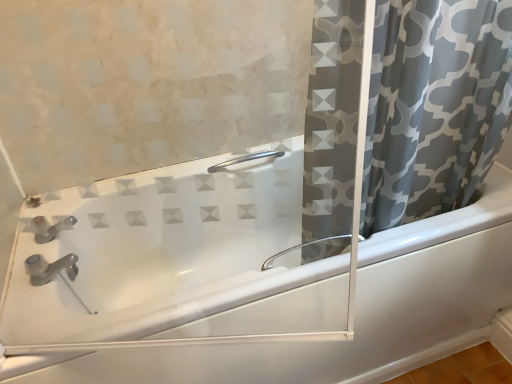
Question: Is gray printed fabric curtain at right at the right side of satin nickel faucet at upper left?

Choices:
 (A) yes
 (B) no

Answer: (A)

Question: Is gray printed fabric curtain at right completely or partially outside of satin nickel faucet at upper left?

Choices:
 (A) no
 (B) yes

Answer: (B)

Question: Does gray printed fabric curtain at right turn towards satin nickel faucet at upper left?

Choices:
 (A) no
 (B) yes

Answer: (A)

Question: Can you confirm if gray printed fabric curtain at right is smaller than satin nickel faucet at upper left?

Choices:
 (A) no
 (B) yes

Answer: (A)

Question: Is satin nickel faucet at upper left located within gray printed fabric curtain at right?

Choices:
 (A) no
 (B) yes

Answer: (A)

Question: From a real-world perspective, is satin nickel grab bar at upper center positioned above or below satin nickel faucet at upper left?

Choices:
 (A) above
 (B) below

Answer: (B)

Question: Is satin nickel grab bar at upper center situated inside satin nickel faucet at upper left or outside?

Choices:
 (A) outside
 (B) inside

Answer: (A)

Question: Considering the positions of satin nickel grab bar at upper center and satin nickel faucet at upper left in the image, is satin nickel grab bar at upper center wider or thinner than satin nickel faucet at upper left?

Choices:
 (A) thin
 (B) wide

Answer: (A)

Question: Is satin nickel grab bar at upper center to the left or to the right of satin nickel faucet at upper left in the image?

Choices:
 (A) right
 (B) left

Answer: (A)

Question: Based on their sizes in the image, would you say gray printed fabric curtain at right is bigger or smaller than white glossy bathtub at center?

Choices:
 (A) big
 (B) small

Answer: (B)

Question: In the image, is gray printed fabric curtain at right on the left side or the right side of white glossy bathtub at center?

Choices:
 (A) right
 (B) left

Answer: (A)

Question: From the image's perspective, is gray printed fabric curtain at right positioned above or below white glossy bathtub at center?

Choices:
 (A) above
 (B) below

Answer: (A)

Question: Considering the positions of gray printed fabric curtain at right and white glossy bathtub at center in the image, is gray printed fabric curtain at right taller or shorter than white glossy bathtub at center?

Choices:
 (A) short
 (B) tall

Answer: (B)

Question: Is white glossy bathtub at center to the left or to the right of satin nickel faucet at upper left in the image?

Choices:
 (A) right
 (B) left

Answer: (A)

Question: Considering the positions of white glossy bathtub at center and satin nickel faucet at upper left in the image, is white glossy bathtub at center taller or shorter than satin nickel faucet at upper left?

Choices:
 (A) tall
 (B) short

Answer: (A)